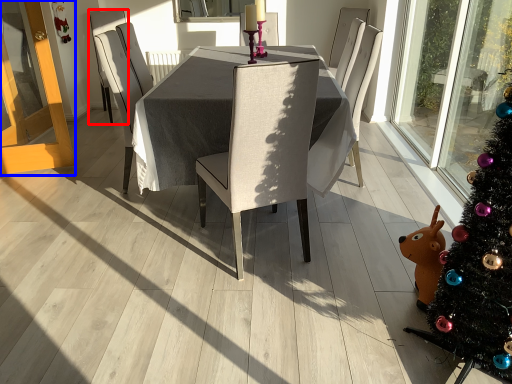
Question: Which of the following is the farthest to the observer, chair (highlighted by a red box) or screen door (highlighted by a blue box)?

Choices:
 (A) chair
 (B) screen door

Answer: (A)